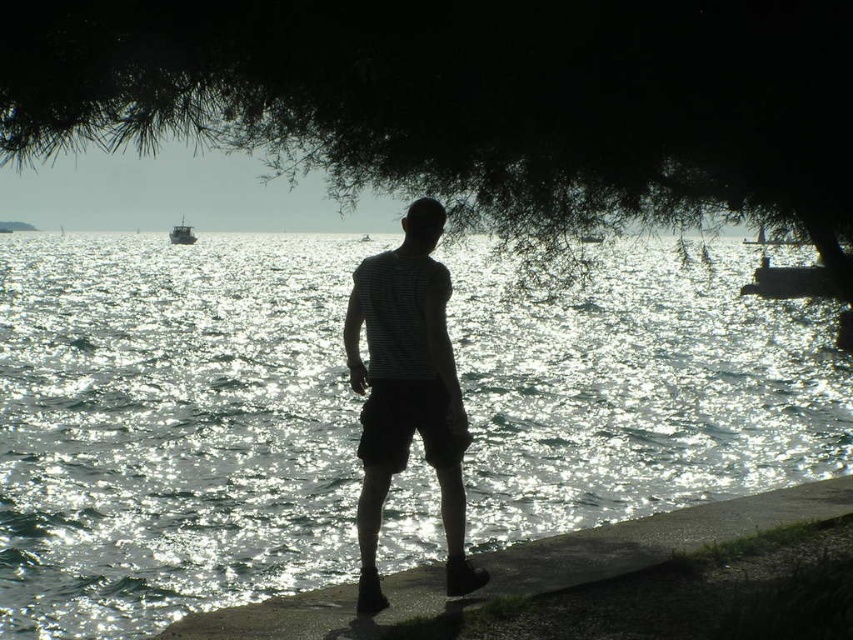
Question: Which point is closer to the camera taking this photo?

Choices:
 (A) (560, 561)
 (B) (419, 435)
 (C) (184, 243)
 (D) (148, 337)

Answer: (B)

Question: Which point is closer to the camera taking this photo?

Choices:
 (A) (392, 420)
 (B) (519, 472)
 (C) (643, 547)

Answer: (A)

Question: Is sparkling silver water at center thinner than dark green leafy tree at upper center?

Choices:
 (A) no
 (B) yes

Answer: (A)

Question: Can you confirm if concrete ledge at lower right is wider than black cotton shorts at center?

Choices:
 (A) no
 (B) yes

Answer: (B)

Question: Can you confirm if sparkling silver water at center is wider than concrete ledge at lower right?

Choices:
 (A) no
 (B) yes

Answer: (B)

Question: Which point is closer to the camera?

Choices:
 (A) dark green leafy tree at upper center
 (B) black cotton shorts at center

Answer: (A)